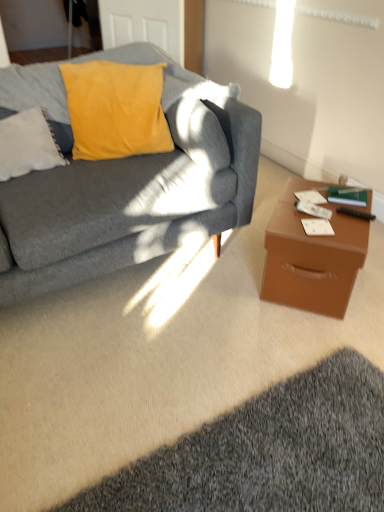
I want to click on free region on the left part of green matte book at right, so click(306, 202).